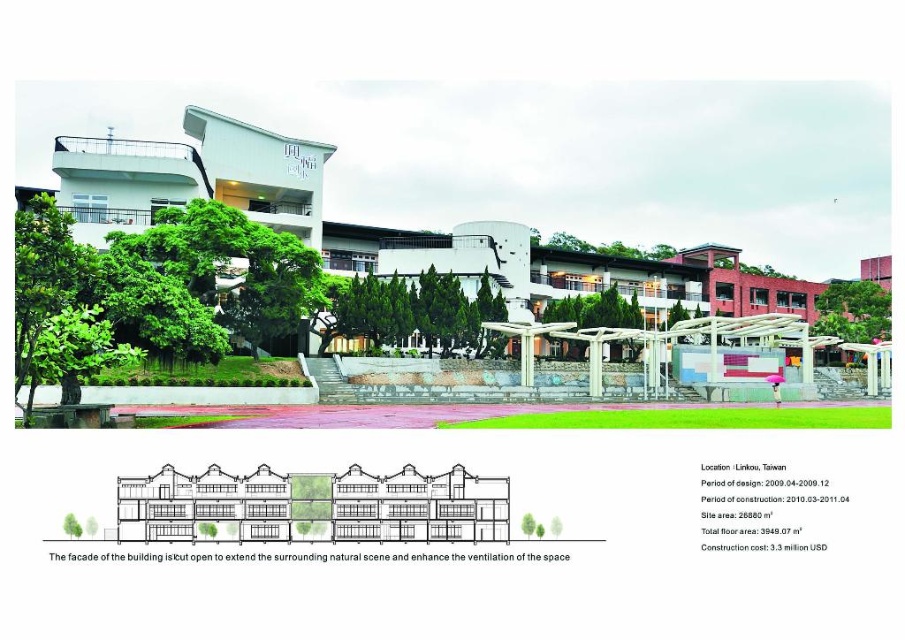
Question: Considering the real-world distances, which object is farthest from the green leafy tree at right?

Choices:
 (A) green leafy tree at upper center
 (B) green leafy tree at center
 (C) green textured tree at center

Answer: (C)

Question: Does green textured tree at center lie in front of green leafy tree at center?

Choices:
 (A) yes
 (B) no

Answer: (A)

Question: Which of the following is the farthest from the observer?

Choices:
 (A) (661, 257)
 (B) (618, 314)
 (C) (424, 328)
 (D) (889, 317)

Answer: (A)

Question: Is green textured tree at center in front of green leafy tree at right?

Choices:
 (A) yes
 (B) no

Answer: (A)

Question: Does green textured tree at center appear under green leafy tree at right?

Choices:
 (A) no
 (B) yes

Answer: (B)

Question: Which of the following is the farthest from the observer?

Choices:
 (A) (564, 246)
 (B) (842, 333)
 (C) (595, 312)
 (D) (365, 300)

Answer: (A)